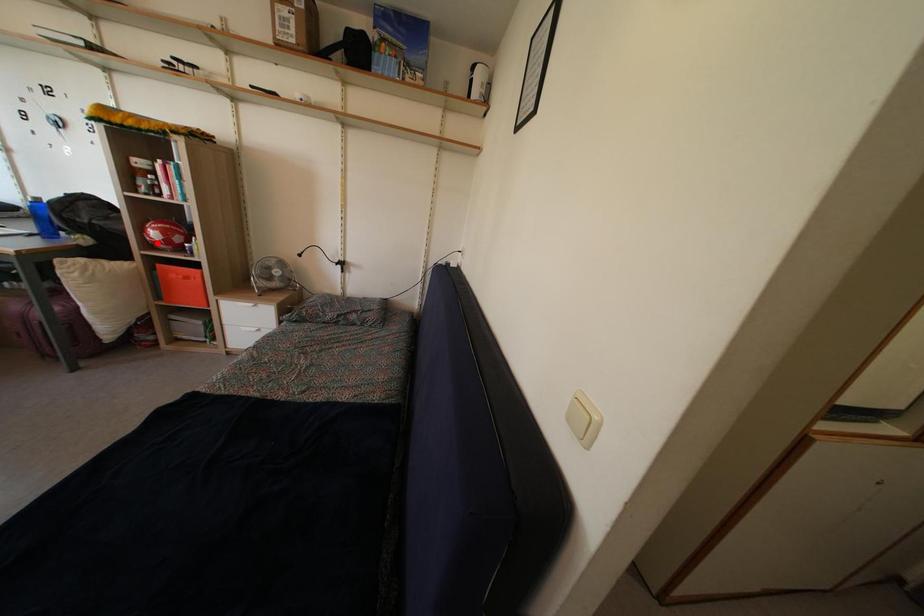
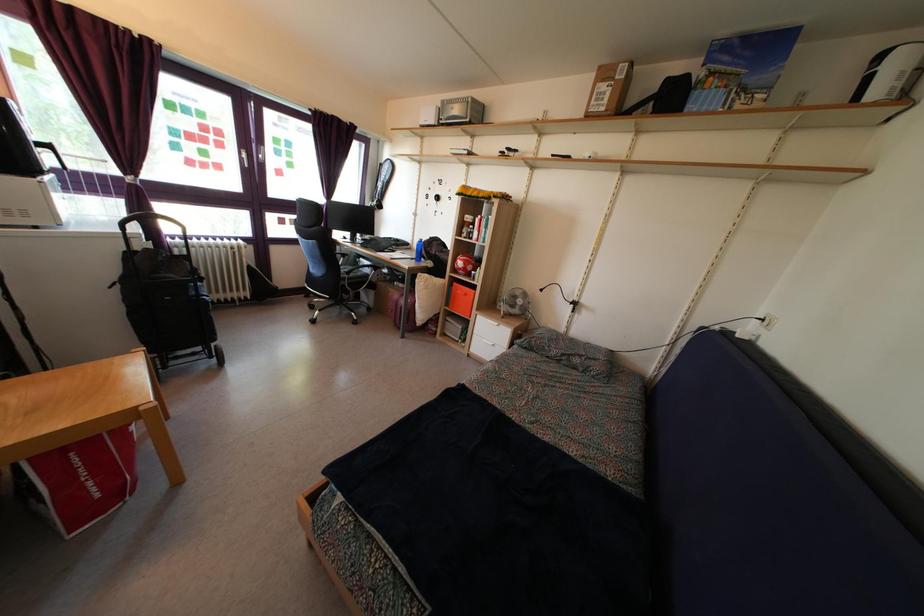
Question: I am providing you with two images of the same scene from different viewpoints. Image1 has a red point marked. In image2, the corresponding 3D location appears at what relative position? Reply with the corresponding letter.

Choices:
 (A) Closer
 (B) Farther

Answer: (A)